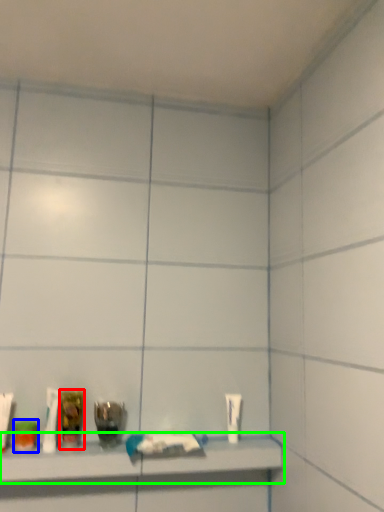
Question: Which is farther away from mouthwash (highlighted by a red box)? mouthwash (highlighted by a blue box) or shelf (highlighted by a green box)?

Choices:
 (A) mouthwash
 (B) shelf

Answer: (B)